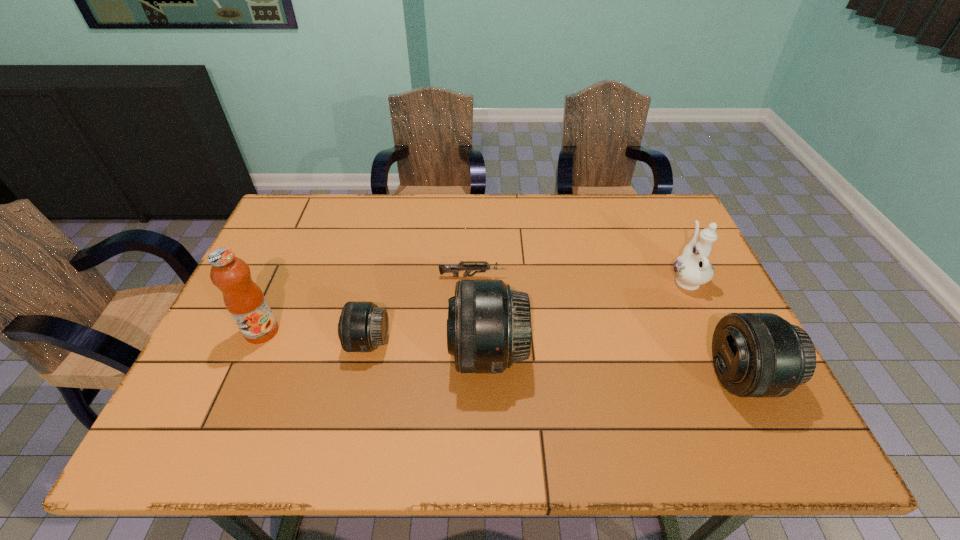
At what (x,y) coordinates should I click in order to perform the action: click on vacant space located 0.150m on the front-facing side of the shortest telephoto lens. Please return your answer as a coordinate pair (x, y). This screenshot has height=540, width=960. Looking at the image, I should click on (287, 342).

Where is `free spot located on the front-facing side of the shortest telephoto lens`? This screenshot has width=960, height=540. free spot located on the front-facing side of the shortest telephoto lens is located at coordinates (230, 342).

You are a GUI agent. You are given a task and a screenshot of the screen. Output one action in this format:
    pyautogui.click(x=<x>, y=<y>)
    Task: Click on the vacant area situated 0.060m on the front-facing side of the second telephoto lens from left to right
    This screenshot has width=960, height=540.
    Given the screenshot: What is the action you would take?
    pyautogui.click(x=426, y=353)

At what (x,y) coordinates should I click in order to perform the action: click on free location located on the front-facing side of the second telephoto lens from left to right. Please return your answer as a coordinate pair (x, y). The width and height of the screenshot is (960, 540). Looking at the image, I should click on (339, 353).

You are a GUI agent. You are given a task and a screenshot of the screen. Output one action in this format:
    pyautogui.click(x=<x>, y=<y>)
    Task: Click on the vacant space situated 0.160m on the front-facing side of the second telephoto lens from left to right
    The image size is (960, 540).
    Given the screenshot: What is the action you would take?
    pyautogui.click(x=385, y=353)

The width and height of the screenshot is (960, 540). In order to click on vacant space located on the front-facing side of the fourth tallest object in this screenshot , I will do [602, 377].

The image size is (960, 540). What are the coordinates of `vacant space located 0.350m on the front-facing side of the fourth tallest object` in the screenshot? It's located at (559, 377).

In order to click on free space located on the front-facing side of the fourth tallest object in this screenshot , I will do `click(581, 377)`.

Locate an element on the screen. vacant space located at the spout of the chinaware is located at coordinates (669, 242).

Find the location of a particular element. This screenshot has height=540, width=960. vacant space located 0.210m at the spout of the chinaware is located at coordinates (659, 219).